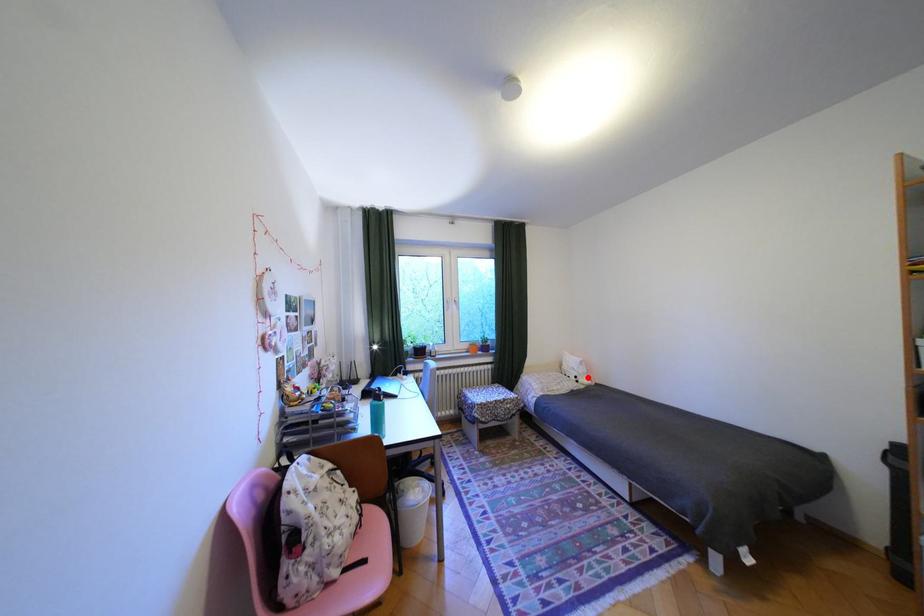
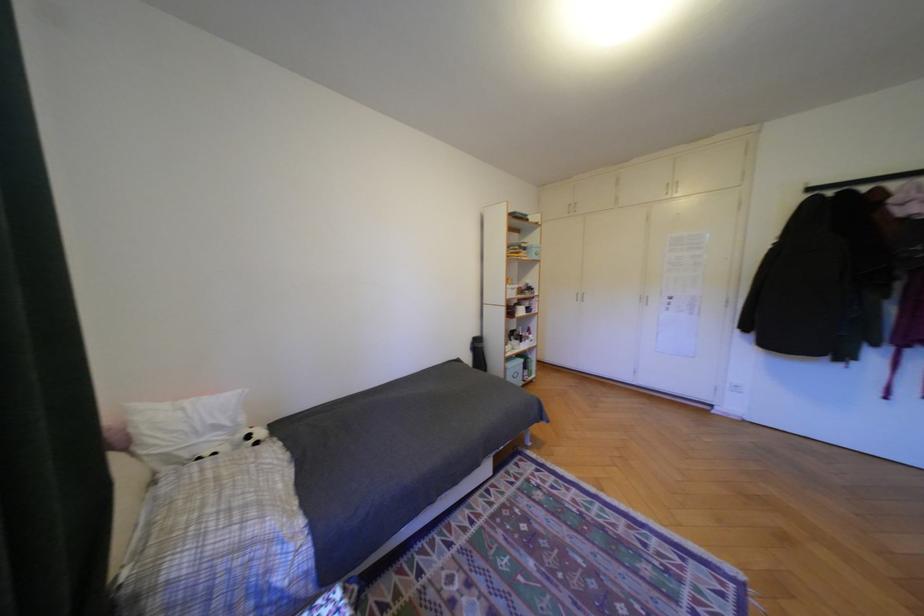
Where in the second image is the point corresponding to the highlighted location from the first image?

(261, 437)